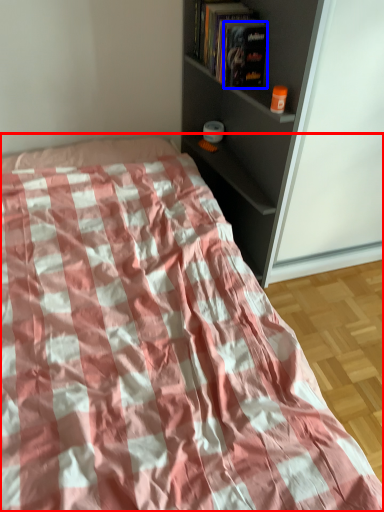
Question: Which object is further to the camera taking this photo, bed (highlighted by a red box) or paperback book (highlighted by a blue box)?

Choices:
 (A) bed
 (B) paperback book

Answer: (B)